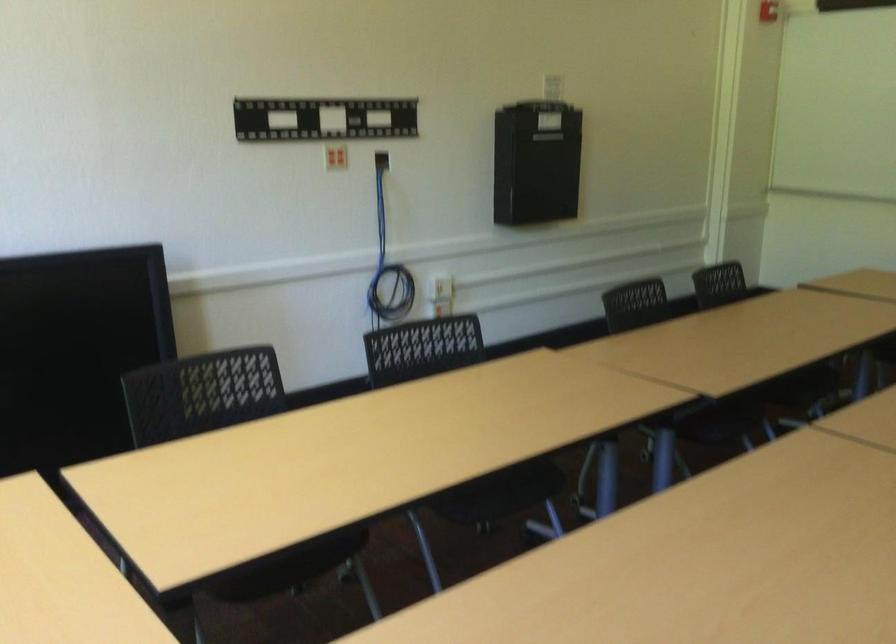
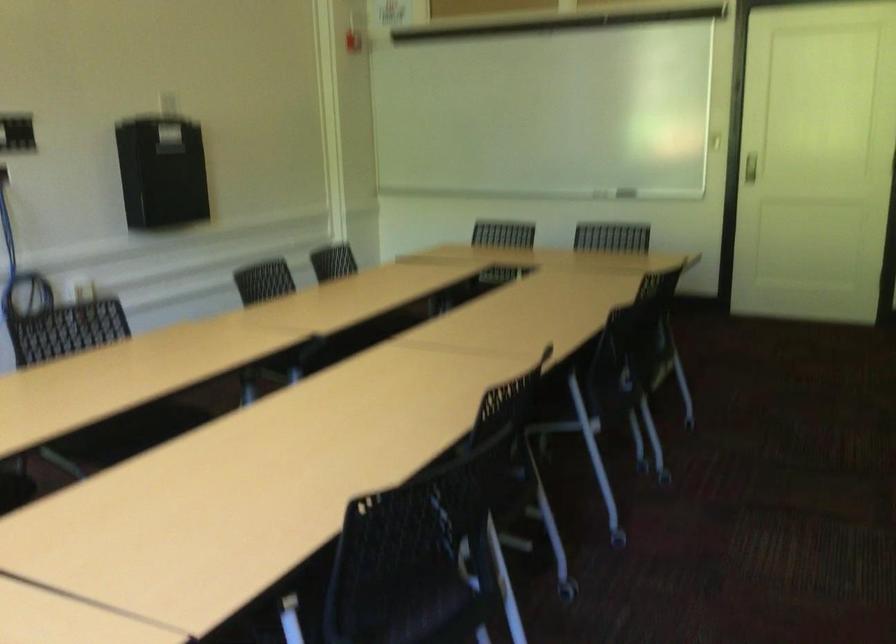
Question: Which direction would the cameraman need to move to produce the second image? Reply with the corresponding letter.

Choices:
 (A) Left
 (B) Right
 (C) Forward
 (D) Backward

Answer: (D)